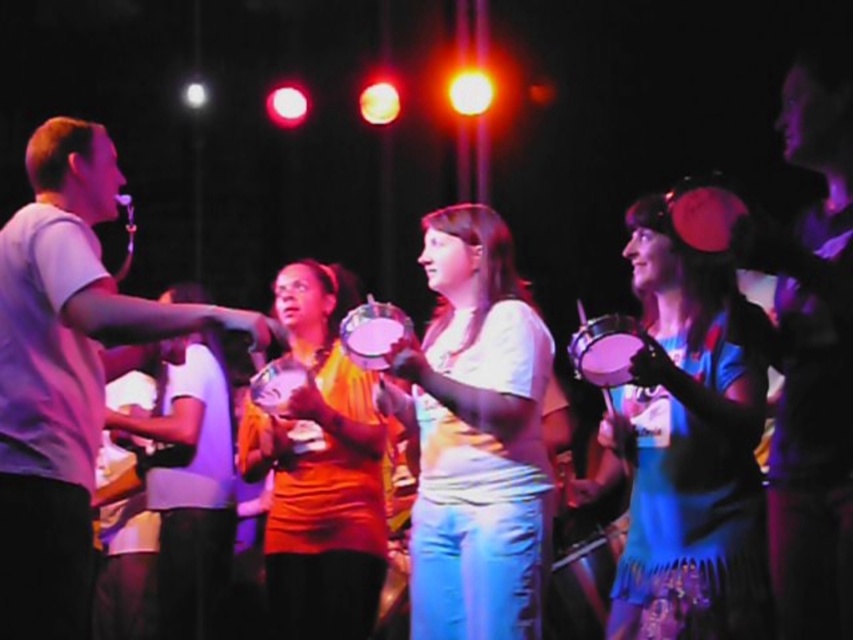
Does white matte shirt at center have a lesser height compared to orange matte drum at center?

Yes, white matte shirt at center is shorter than orange matte drum at center.

Between white matte shirt at center and orange matte drum at center, which one has more height?

orange matte drum at center is taller.

Identify the location of white matte shirt at center. (476, 436).

Identify the location of white matte shirt at center. This screenshot has width=853, height=640. (476, 436).

Can you confirm if blue fabric tambourine at right is positioned below matte plastic tambourine at center?

Yes, blue fabric tambourine at right is below matte plastic tambourine at center.

Based on the photo, which of these two, blue fabric tambourine at right or matte plastic tambourine at center, stands shorter?

matte plastic tambourine at center is shorter.

This screenshot has width=853, height=640. Identify the location of blue fabric tambourine at right. (689, 445).

Locate an element on the screen. The height and width of the screenshot is (640, 853). blue fabric tambourine at right is located at coordinates (689, 445).

Who is positioned more to the right, blue fabric tambourine at right or white matte shirt at center?

blue fabric tambourine at right

What do you see at coordinates (689, 445) in the screenshot? I see `blue fabric tambourine at right` at bounding box center [689, 445].

The height and width of the screenshot is (640, 853). Identify the location of blue fabric tambourine at right. (689, 445).